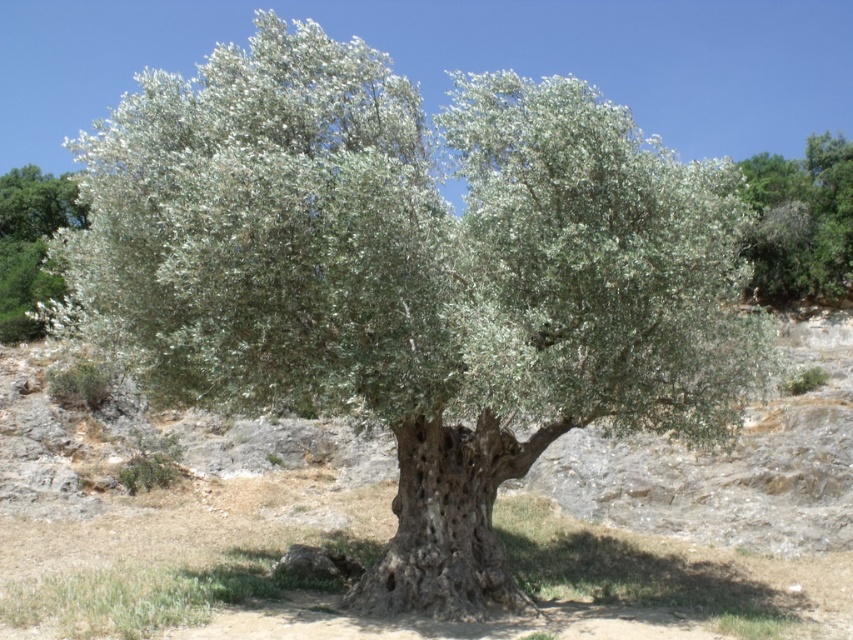
You are an artist trying to sketch the scene. The canvas is divided into a grid with coordinates from 0 to 1 in both x and y directions. You need to place the green leafy tree at upper right accurately. What are the coordinates where you should position it?

The coordinates for the green leafy tree at upper right are at point 0.347 in the x direction and 0.940 in the y direction.